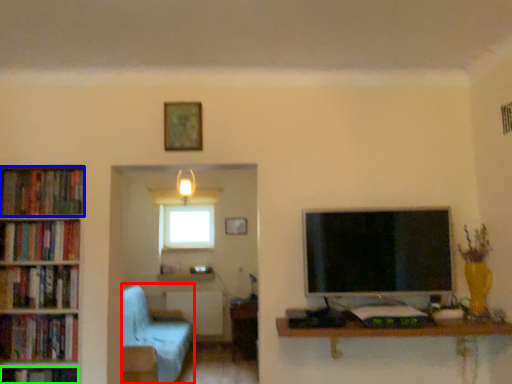
Question: Based on their relative distances, which object is farther from armchair (highlighted by a red box)? Choose from book (highlighted by a blue box) and book (highlighted by a green box).

Choices:
 (A) book
 (B) book

Answer: (A)